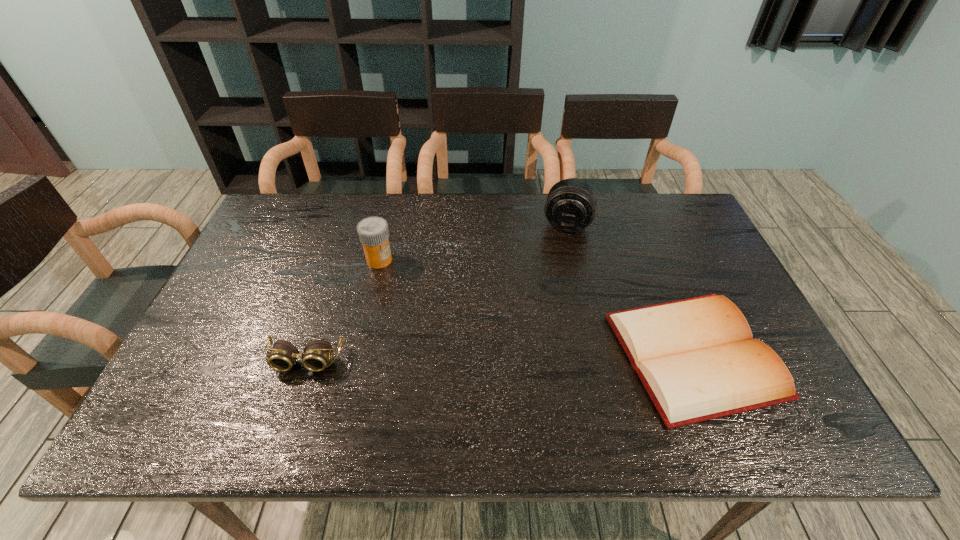
Locate an element on the screen. The image size is (960, 540). vacant space that is in between the third shortest object and the Bible is located at coordinates (537, 307).

I want to click on blank region between the telephoto lens and the medicine, so click(x=473, y=241).

Locate an element on the screen. free space between the telephoto lens and the second shortest object is located at coordinates (436, 292).

Identify the location of empty space between the Bible and the goggles. Image resolution: width=960 pixels, height=540 pixels. (499, 358).

Image resolution: width=960 pixels, height=540 pixels. I want to click on free space between the Bible and the second farthest object, so click(x=537, y=307).

I want to click on object identified as the second closest to the shortest object, so click(373, 232).

Locate which object ranks second in proximity to the farthest object. Please provide its 2D coordinates. Your answer should be formatted as a tuple, i.e. [(x, y)], where the tuple contains the x and y coordinates of a point satisfying the conditions above.

[(373, 232)]